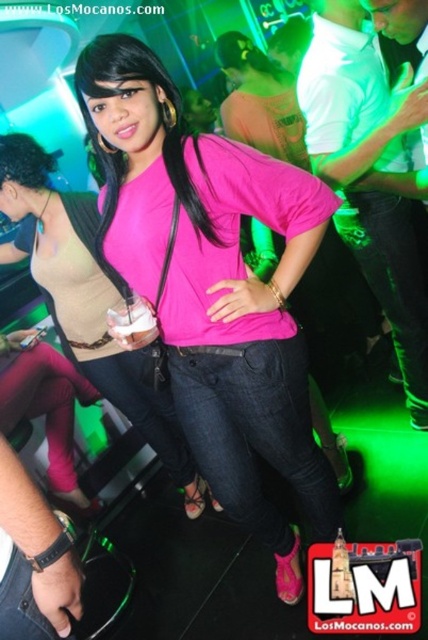
Question: Which point is farther to the camera?

Choices:
 (A) (395, 310)
 (B) (130, 364)

Answer: (B)

Question: Which is nearer to the pink matte shirt at center?

Choices:
 (A) white cotton shirt at upper right
 (B) matte pink shirt at center

Answer: (B)

Question: Can you confirm if white cotton shirt at upper right is positioned above pink matte shirt at center?

Choices:
 (A) no
 (B) yes

Answer: (B)

Question: Considering the relative positions of matte pink shirt at center and white cotton shirt at upper right in the image provided, where is matte pink shirt at center located with respect to white cotton shirt at upper right?

Choices:
 (A) left
 (B) right

Answer: (A)

Question: Can you confirm if matte pink shirt at center is thinner than white cotton shirt at upper right?

Choices:
 (A) yes
 (B) no

Answer: (B)

Question: Which point is farther from the camera taking this photo?

Choices:
 (A) (91, 300)
 (B) (350, 168)

Answer: (A)